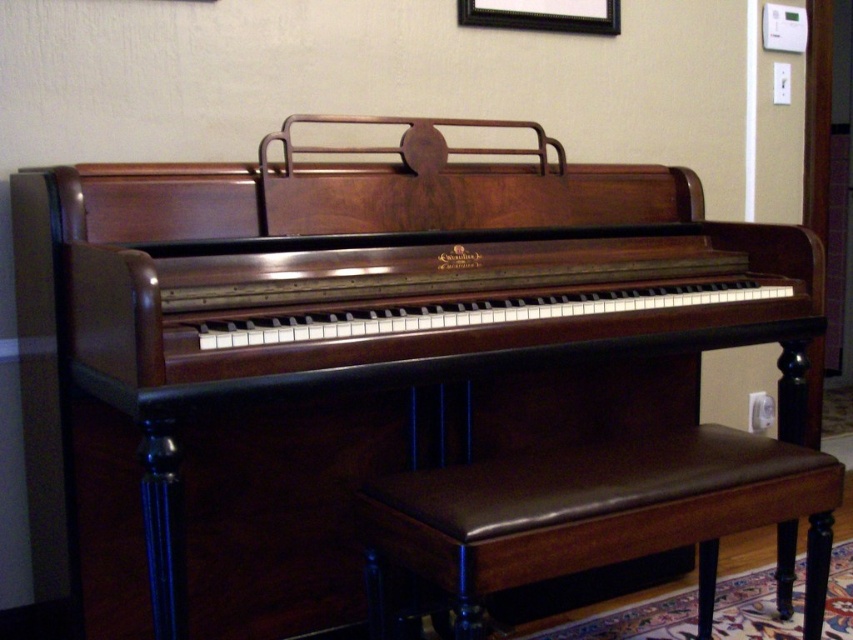
How much distance is there between brown leather stool at center and black wood picture frame at upper center?

4.42 feet

Which is above, brown leather stool at center or black wood picture frame at upper center?

Positioned higher is black wood picture frame at upper center.

Does point (695, 458) lie behind point (479, 22)?

No, it is in front of (479, 22).

You are a GUI agent. You are given a task and a screenshot of the screen. Output one action in this format:
    pyautogui.click(x=<x>, y=<y>)
    Task: Click on the brown leather stool at center
    The width and height of the screenshot is (853, 640).
    Given the screenshot: What is the action you would take?
    pyautogui.click(x=595, y=515)